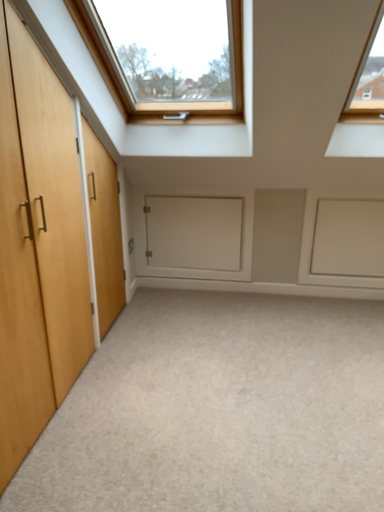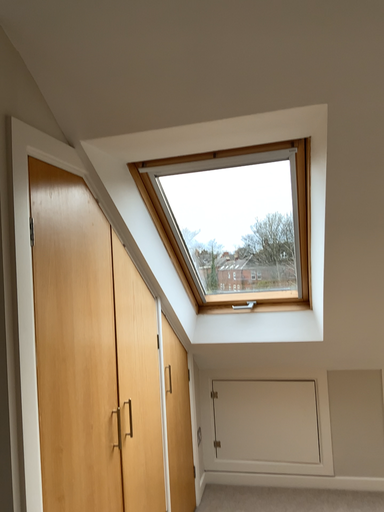
Question: How did the camera likely rotate when shooting the video?

Choices:
 (A) rotated downward
 (B) rotated upward

Answer: (B)